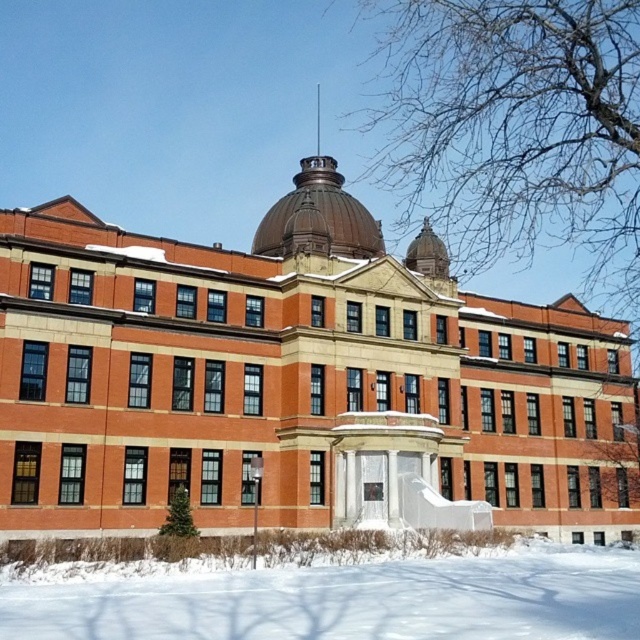
Question: Does white powdery snow at lower center have a greater width compared to shiny brown dome at center?

Choices:
 (A) no
 (B) yes

Answer: (B)

Question: Can you confirm if white powdery snow at lower center is positioned below shiny brown dome at center?

Choices:
 (A) yes
 (B) no

Answer: (A)

Question: Does white powdery snow at lower center have a greater width compared to shiny brown dome at center?

Choices:
 (A) no
 (B) yes

Answer: (B)

Question: Which point is closer to the camera?

Choices:
 (A) white powdery snow at lower center
 (B) shiny brown dome at center

Answer: (A)

Question: Which point is closer to the camera?

Choices:
 (A) (257, 252)
 (B) (584, 600)

Answer: (B)

Question: Which point is farther to the camera?

Choices:
 (A) shiny brown dome at center
 (B) white powdery snow at lower center

Answer: (A)